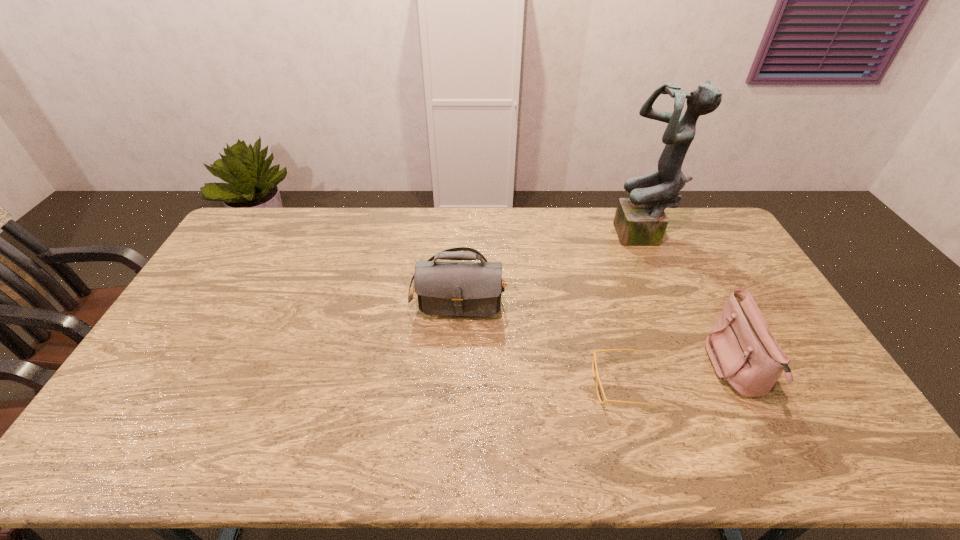
In order to click on blank region between the leftmost object and the sculpture in this screenshot , I will do `click(551, 261)`.

In order to click on free space between the left shoulder bag and the third tallest object in this screenshot , I will do (597, 327).

This screenshot has width=960, height=540. What are the coordinates of `vacant space that's between the tallest object and the taller shoulder bag` in the screenshot? It's located at (551, 261).

At what (x,y) coordinates should I click in order to perform the action: click on the closest object to the sculpture. Please return your answer as a coordinate pair (x, y). Looking at the image, I should click on (744, 353).

Select which object is the second closest to the second tallest object. Please provide its 2D coordinates. Your answer should be formatted as a tuple, i.e. [(x, y)], where the tuple contains the x and y coordinates of a point satisfying the conditions above.

[(640, 220)]

Identify the location of vacant space that satisfies the following two spatial constraints: 1. on the face of the sculpture; 2. on the front side of the farther shoulder bag. (665, 285).

The image size is (960, 540). Find the location of `vacant area in the image that satisfies the following two spatial constraints: 1. on the face of the sculpture; 2. on the front side of the left shoulder bag`. vacant area in the image that satisfies the following two spatial constraints: 1. on the face of the sculpture; 2. on the front side of the left shoulder bag is located at coordinates (665, 285).